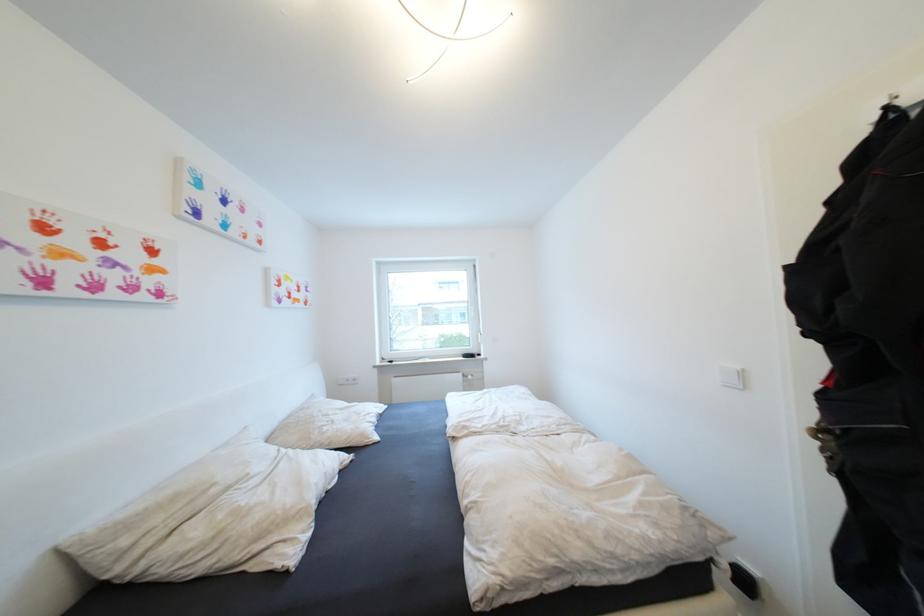
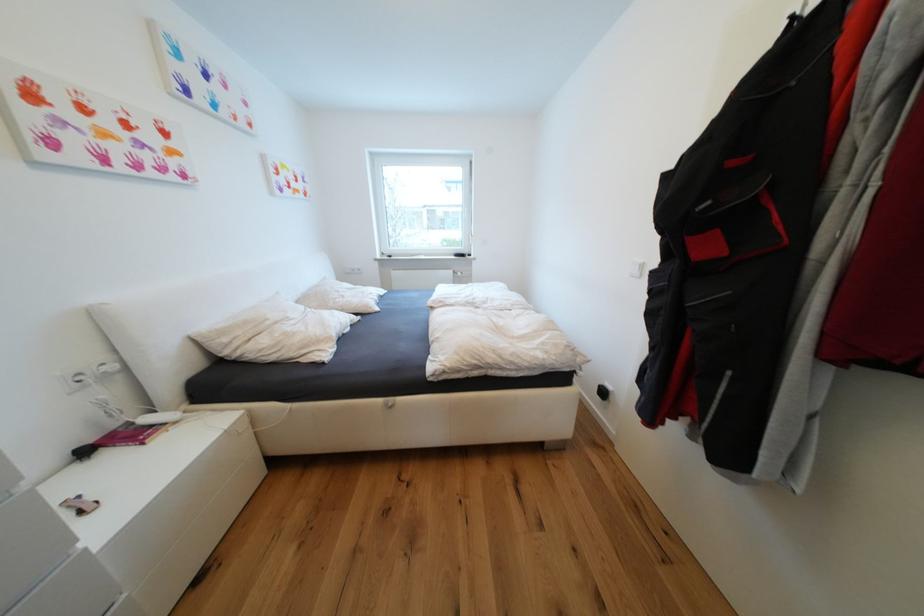
In the second image, find the point that corresponds to point 339,423 in the first image.

(349, 297)